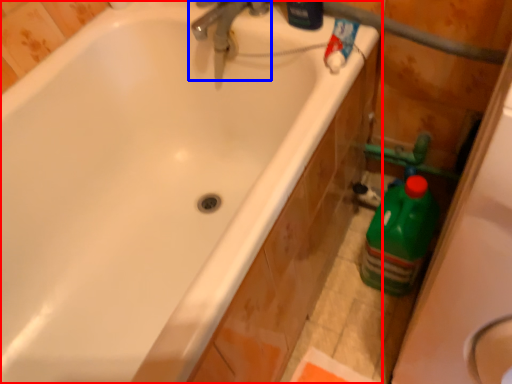
Question: Among these objects, which one is nearest to the camera, bathtub (highlighted by a red box) or tap (highlighted by a blue box)?

Choices:
 (A) bathtub
 (B) tap

Answer: (A)